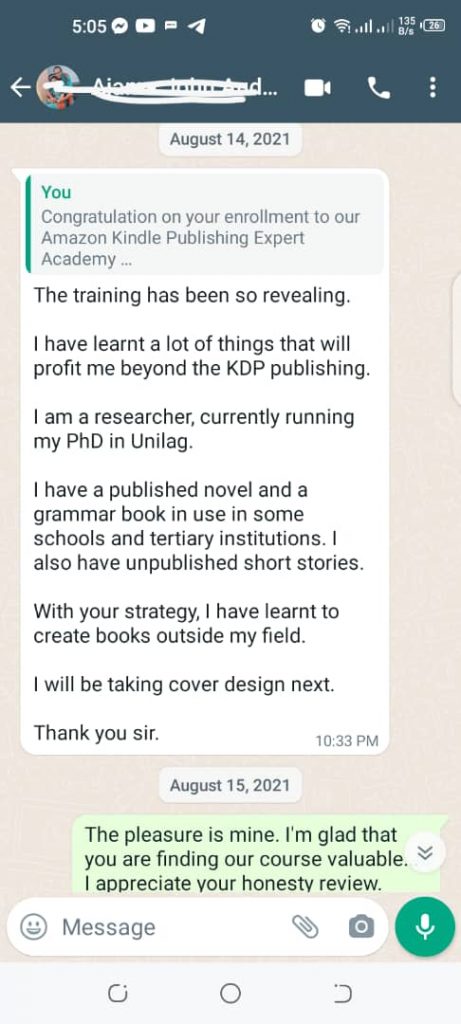
Identify the location of alarm. This screenshot has width=461, height=1024. (321, 24).